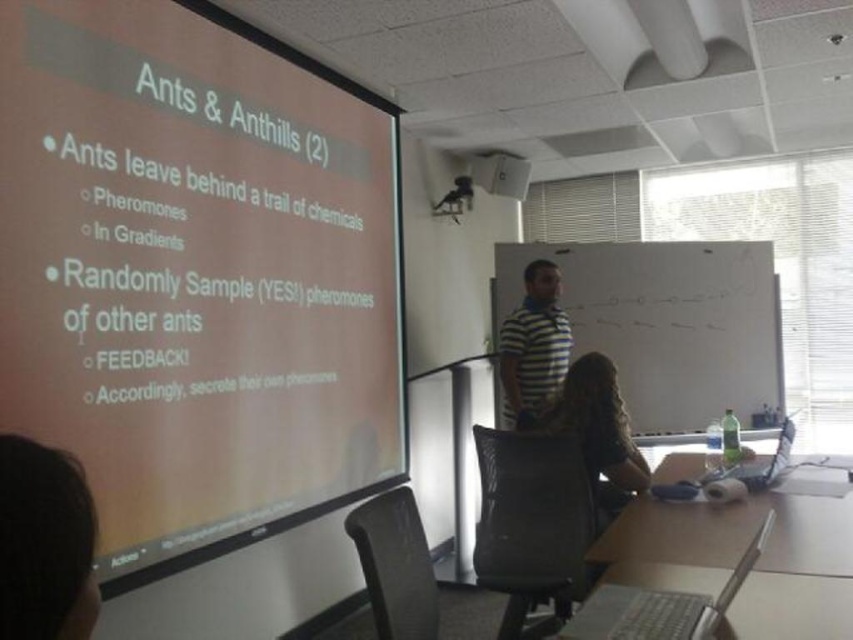
Is point (753, 611) positioned in front of point (637, 460)?

That is True.

Can you confirm if silver metallic table at lower right is wider than dark brown leather chair at lower center?

Correct, the width of silver metallic table at lower right exceeds that of dark brown leather chair at lower center.

Identify the location of silver metallic table at lower right. (790, 608).

Find the location of `silver metallic table at lower right`. silver metallic table at lower right is located at coordinates (790, 608).

Is dark brown leather chair at lower center positioned before striped cotton shirt at center?

Yes, dark brown leather chair at lower center is closer to the viewer.

Is dark brown leather chair at lower center to the right of striped cotton shirt at center from the viewer's perspective?

Correct, you'll find dark brown leather chair at lower center to the right of striped cotton shirt at center.

Identify the location of dark brown leather chair at lower center. The width and height of the screenshot is (853, 640). (596, 432).

Describe the element at coordinates (192, 273) in the screenshot. I see `matte orange projector screen at upper left` at that location.

Between point (190, 369) and point (91, 524), which one is positioned behind?

Positioned behind is point (190, 369).

Image resolution: width=853 pixels, height=640 pixels. What are the coordinates of `matte orange projector screen at upper left` in the screenshot? It's located at (192, 273).